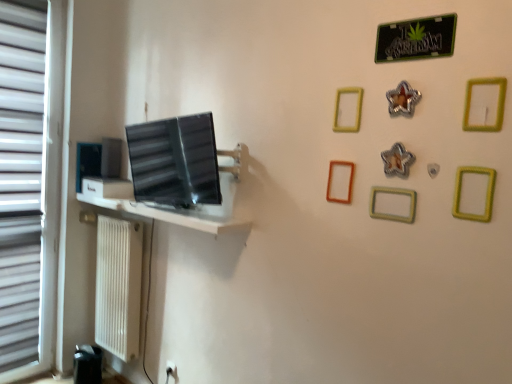
The width and height of the screenshot is (512, 384). Describe the element at coordinates (175, 161) in the screenshot. I see `satin black monitor at center` at that location.

At what (x,y) coordinates should I click in order to perform the action: click on white textured radiator at lower left. Please return your answer as a coordinate pair (x, y). This screenshot has height=384, width=512. Looking at the image, I should click on (118, 286).

This screenshot has height=384, width=512. I want to click on white plastic electric outlet at lower left, so click(x=170, y=370).

How much space does green matte picture frame at center-right, arranged as the fourth picture frame when viewed from the left, occupy horizontally?

green matte picture frame at center-right, arranged as the fourth picture frame when viewed from the left, is 0.60 inches in width.

Locate an element on the screen. The image size is (512, 384). metallic star at upper center, arranged as the 5th picture frame when viewed from the back is located at coordinates (397, 160).

Considering their positions, is yellow matte picture frame at upper right, positioned as the 2th picture frame in right-to-left order, located in front of or behind white textured radiator at lower left?

In the image, yellow matte picture frame at upper right, positioned as the 2th picture frame in right-to-left order, appears in front of white textured radiator at lower left.

Between yellow matte picture frame at upper right, the seventh picture frame in the back-to-front sequence, and white textured radiator at lower left, which one has larger width?

Wider between the two is white textured radiator at lower left.

Is yellow matte picture frame at upper right, the seventh picture frame in the back-to-front sequence, completely or partially outside of white textured radiator at lower left?

yellow matte picture frame at upper right, the seventh picture frame in the back-to-front sequence, lies outside white textured radiator at lower left's area.

How different are the orientations of yellow matte picture frame at upper right, which appears as the second picture frame when viewed from the front, and white textured radiator at lower left in degrees?

The facing directions of yellow matte picture frame at upper right, which appears as the second picture frame when viewed from the front, and white textured radiator at lower left are 0.894 degrees apart.

Is green matte picture frame at upper right, which is the first picture frame in front-to-back order, positioned with its back to white plastic blind at left?

No, green matte picture frame at upper right, which is the first picture frame in front-to-back order,'s orientation is not away from white plastic blind at left.

Which is correct: green matte picture frame at upper right, placed as the 1th picture frame when sorted from right to left, is inside white plastic blind at left, or outside of it?

green matte picture frame at upper right, placed as the 1th picture frame when sorted from right to left, lies outside white plastic blind at left.

Is green matte picture frame at upper right, which is the first picture frame in front-to-back order, behind white plastic blind at left?

No, green matte picture frame at upper right, which is the first picture frame in front-to-back order, is closer to the viewer.

Considering the sizes of green matte picture frame at upper right, placed as the 1th picture frame when sorted from right to left, and white plastic blind at left in the image, is green matte picture frame at upper right, placed as the 1th picture frame when sorted from right to left, bigger or smaller than white plastic blind at left?

green matte picture frame at upper right, placed as the 1th picture frame when sorted from right to left, is smaller than white plastic blind at left.

Is point (169, 363) positioned in front of point (347, 90)?

No, (169, 363) is further to viewer.

Looking at their sizes, would you say white plastic electric outlet at lower left is wider or thinner than yellow matte picture frame at upper center, positioned as the third picture frame in left-to-right order?

white plastic electric outlet at lower left is wider than yellow matte picture frame at upper center, positioned as the third picture frame in left-to-right order.

Based on their positions, is white plastic electric outlet at lower left located to the left or right of yellow matte picture frame at upper center, which is counted as the sixth picture frame, starting from the front?

white plastic electric outlet at lower left is to the left of yellow matte picture frame at upper center, which is counted as the sixth picture frame, starting from the front.

Can you confirm if green metallic sign at upper right is shorter than yellow matte picture frame at upper center, positioned as the third picture frame in left-to-right order?

Yes.

Between green metallic sign at upper right and yellow matte picture frame at upper center, which is counted as the 3th picture frame, starting from the back, which one has smaller size?

Smaller between the two is yellow matte picture frame at upper center, which is counted as the 3th picture frame, starting from the back.

Based on the photo, considering their positions, is green metallic sign at upper right located in front of or behind yellow matte picture frame at upper center, which is counted as the 3th picture frame, starting from the back?

In the image, green metallic sign at upper right appears in front of yellow matte picture frame at upper center, which is counted as the 3th picture frame, starting from the back.

Looking at their sizes, would you say green metallic sign at upper right is wider or thinner than yellow matte picture frame at upper center, which is counted as the 3th picture frame, starting from the back?

In the image, green metallic sign at upper right appears to be wider than yellow matte picture frame at upper center, which is counted as the 3th picture frame, starting from the back.

Does white plastic electric outlet at lower left appear on the left side of silver metallic star at upper center, the third picture frame when ordered from front to back?

Yes, white plastic electric outlet at lower left is to the left of silver metallic star at upper center, the third picture frame when ordered from front to back.

Considering the sizes of objects white plastic electric outlet at lower left and silver metallic star at upper center, marked as the 3th picture frame in a right-to-left arrangement, in the image provided, who is shorter, white plastic electric outlet at lower left or silver metallic star at upper center, marked as the 3th picture frame in a right-to-left arrangement,?

With less height is white plastic electric outlet at lower left.

From the picture: From a real-world perspective, is white plastic electric outlet at lower left on top of silver metallic star at upper center, marked as the 3th picture frame in a right-to-left arrangement?

Actually, white plastic electric outlet at lower left is physically below silver metallic star at upper center, marked as the 3th picture frame in a right-to-left arrangement, in the real world.

How different are the orientations of white plastic electric outlet at lower left and silver metallic star at upper center, marked as the 3th picture frame in a right-to-left arrangement, in degrees?

white plastic electric outlet at lower left and silver metallic star at upper center, marked as the 3th picture frame in a right-to-left arrangement, are facing 1.25 degrees away from each other.

In the scene shown: Does satin black monitor at center have a greater height compared to brown matte picture frame at center-right, positioned as the second picture frame in back-to-front order?

Correct, satin black monitor at center is much taller as brown matte picture frame at center-right, positioned as the second picture frame in back-to-front order.

Consider the image. Is the depth of satin black monitor at center less than that of brown matte picture frame at center-right, the second picture frame positioned from the left?

No, it is behind brown matte picture frame at center-right, the second picture frame positioned from the left.

Measure the distance between satin black monitor at center and brown matte picture frame at center-right, acting as the 7th picture frame starting from the right.

satin black monitor at center and brown matte picture frame at center-right, acting as the 7th picture frame starting from the right, are 32.00 inches apart.

From a real-world perspective, which is physically below, satin black monitor at center or yellow matte picture frame at upper center, acting as the sixth picture frame starting from the right?

satin black monitor at center is physically lower.

Would you say satin black monitor at center is outside yellow matte picture frame at upper center, which is counted as the sixth picture frame, starting from the front?

Yes, satin black monitor at center is not within yellow matte picture frame at upper center, which is counted as the sixth picture frame, starting from the front.

Is satin black monitor at center at the left side of yellow matte picture frame at upper center, positioned as the third picture frame in left-to-right order?

Indeed, satin black monitor at center is positioned on the left side of yellow matte picture frame at upper center, positioned as the third picture frame in left-to-right order.

Starting from the white textured radiator at lower left, which picture frame is the 6th one in front? Please provide its 2D coordinates.

[(486, 193)]

Where is `blind behind the green matte picture frame at upper right, which is the first picture frame in front-to-back order`? This screenshot has width=512, height=384. blind behind the green matte picture frame at upper right, which is the first picture frame in front-to-back order is located at coordinates (21, 176).

Looking at the image, which one is located further to white plastic blind at left, yellow matte picture frame at upper right, positioned as the 2th picture frame in right-to-left order, or silver metallic star at upper center, which is counted as the sixth picture frame, starting from the left?

yellow matte picture frame at upper right, positioned as the 2th picture frame in right-to-left order, lies further to white plastic blind at left than the other object.

From the image, which object appears to be farther from brown matte picture frame at center-right, acting as the 7th picture frame starting from the right, green matte picture frame at center-right, which is the fifth picture frame in front-to-back order, or silver metallic star at upper center, arranged as the sixth picture frame when viewed from the back?

Among the two, silver metallic star at upper center, arranged as the sixth picture frame when viewed from the back, is located further to brown matte picture frame at center-right, acting as the 7th picture frame starting from the right.

Which object lies further to the anchor point white plastic electric outlet at lower left, green matte picture frame at center-right, placed as the 4th picture frame when sorted from back to front, or white plastic blind at left?

green matte picture frame at center-right, placed as the 4th picture frame when sorted from back to front, is positioned further to the anchor white plastic electric outlet at lower left.

Looking at the image, which one is located further to matte black picture frame at left, acting as the first picture frame starting from the back, green metallic sign at upper right or yellow matte picture frame at upper right, the seventh picture frame in the back-to-front sequence?

yellow matte picture frame at upper right, the seventh picture frame in the back-to-front sequence, is positioned further to the anchor matte black picture frame at left, acting as the first picture frame starting from the back.

From the image, which object appears to be nearer to matte black picture frame at left, which appears as the 8th picture frame when viewed from the right, silver metallic star at upper center, arranged as the sixth picture frame when viewed from the back, or white plastic blind at left?

white plastic blind at left.

Looking at the image, which one is located further to green metallic sign at upper right, green matte picture frame at upper right, placed as the 1th picture frame when sorted from right to left, or yellow matte picture frame at upper center, which is counted as the sixth picture frame, starting from the front?

The object further to green metallic sign at upper right is yellow matte picture frame at upper center, which is counted as the sixth picture frame, starting from the front.

Based on their spatial positions, is yellow matte picture frame at upper right, the seventh picture frame in the back-to-front sequence, or satin black monitor at center closer to metallic star at upper center, arranged as the fifth picture frame when viewed from the left?

Among the two, yellow matte picture frame at upper right, the seventh picture frame in the back-to-front sequence, is located nearer to metallic star at upper center, arranged as the fifth picture frame when viewed from the left.

From the image, which object appears to be farther from green matte picture frame at upper right, marked as the 8th picture frame in a left-to-right arrangement, matte black picture frame at left, the eighth picture frame in the front-to-back sequence, or white textured radiator at lower left?

matte black picture frame at left, the eighth picture frame in the front-to-back sequence, is positioned further to the anchor green matte picture frame at upper right, marked as the 8th picture frame in a left-to-right arrangement.

Identify the location of picture frame between green metallic sign at upper right and yellow matte picture frame at upper center, acting as the sixth picture frame starting from the right, in the up-down direction. This screenshot has height=384, width=512. (402, 99).

You are a GUI agent. You are given a task and a screenshot of the screen. Output one action in this format:
    pyautogui.click(x=<x>, y=<y>)
    Task: Click on the bulletin board between white plastic blind at left and green matte picture frame at upper right, placed as the 1th picture frame when sorted from right to left
    The image size is (512, 384).
    Given the screenshot: What is the action you would take?
    pyautogui.click(x=416, y=39)

Locate an element on the screen. electric outlet between matte black picture frame at left, the 1th picture frame from the left, and yellow matte picture frame at upper right, which is counted as the seventh picture frame, starting from the left, from left to right is located at coordinates (170, 370).

You are a GUI agent. You are given a task and a screenshot of the screen. Output one action in this format:
    pyautogui.click(x=<x>, y=<y>)
    Task: Click on the computer monitor between matte black picture frame at left, the 1th picture frame from the left, and yellow matte picture frame at upper right, which is counted as the seventh picture frame, starting from the left
    
    Given the screenshot: What is the action you would take?
    pyautogui.click(x=175, y=161)